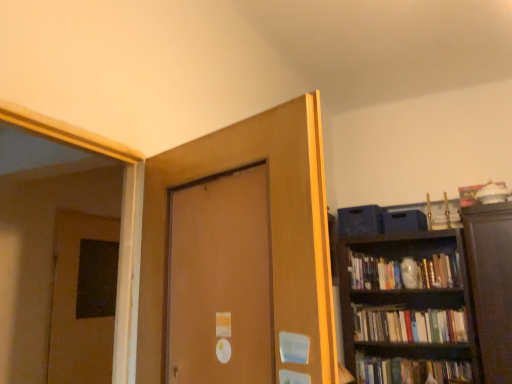
Question: From a real-world perspective, is matte brown door at center, placed as the 2th door when sorted from left to right, over brown matte door at left, placed as the second door when sorted from front to back?

Choices:
 (A) no
 (B) yes

Answer: (B)

Question: From the image's perspective, is matte brown door at center, arranged as the second door when viewed from the back, located above brown matte door at left, placed as the 1th door when sorted from left to right?

Choices:
 (A) yes
 (B) no

Answer: (A)

Question: Can you confirm if matte brown door at center, which appears as the 1th door when viewed from the right, is wider than brown matte door at left, placed as the 1th door when sorted from left to right?

Choices:
 (A) no
 (B) yes

Answer: (B)

Question: Can you confirm if matte brown door at center, which appears as the 1th door when viewed from the right, is taller than brown matte door at left, which ranks as the 1th door in back-to-front order?

Choices:
 (A) yes
 (B) no

Answer: (B)

Question: Is matte brown door at center, the first door when ordered from front to back, further to camera compared to brown matte door at left, placed as the 1th door when sorted from left to right?

Choices:
 (A) yes
 (B) no

Answer: (B)

Question: Is point (58, 336) closer or farther from the camera than point (312, 331)?

Choices:
 (A) farther
 (B) closer

Answer: (A)

Question: Is brown matte door at left, placed as the 1th door when sorted from left to right, wider or thinner than matte brown door at center, arranged as the second door when viewed from the back?

Choices:
 (A) wide
 (B) thin

Answer: (B)

Question: Considering the positions of brown matte door at left, placed as the second door when sorted from front to back, and matte brown door at center, which appears as the 1th door when viewed from the right, in the image, is brown matte door at left, placed as the second door when sorted from front to back, taller or shorter than matte brown door at center, which appears as the 1th door when viewed from the right,?

Choices:
 (A) short
 (B) tall

Answer: (B)

Question: Is brown matte door at left, placed as the second door when sorted from front to back, inside the boundaries of matte brown door at center, which appears as the 1th door when viewed from the right, or outside?

Choices:
 (A) outside
 (B) inside

Answer: (A)

Question: Is hardcover books at right taller or shorter than matte brown door at center, placed as the 2th door when sorted from left to right?

Choices:
 (A) tall
 (B) short

Answer: (B)

Question: Based on their sizes in the image, would you say hardcover books at right is bigger or smaller than matte brown door at center, the first door when ordered from front to back?

Choices:
 (A) big
 (B) small

Answer: (B)

Question: Which is correct: hardcover books at right is inside matte brown door at center, placed as the 2th door when sorted from left to right, or outside of it?

Choices:
 (A) inside
 (B) outside

Answer: (B)

Question: Relative to matte brown door at center, placed as the 2th door when sorted from left to right, is hardcover books at right in front or behind?

Choices:
 (A) front
 (B) behind

Answer: (B)

Question: From their relative heights in the image, would you say matte brown door at center, which appears as the 1th door when viewed from the right, is taller or shorter than brown matte door at left, placed as the 1th door when sorted from left to right?

Choices:
 (A) short
 (B) tall

Answer: (A)

Question: From the image's perspective, relative to brown matte door at left, placed as the second door when sorted from front to back, is matte brown door at center, which appears as the 1th door when viewed from the right, above or below?

Choices:
 (A) above
 (B) below

Answer: (A)